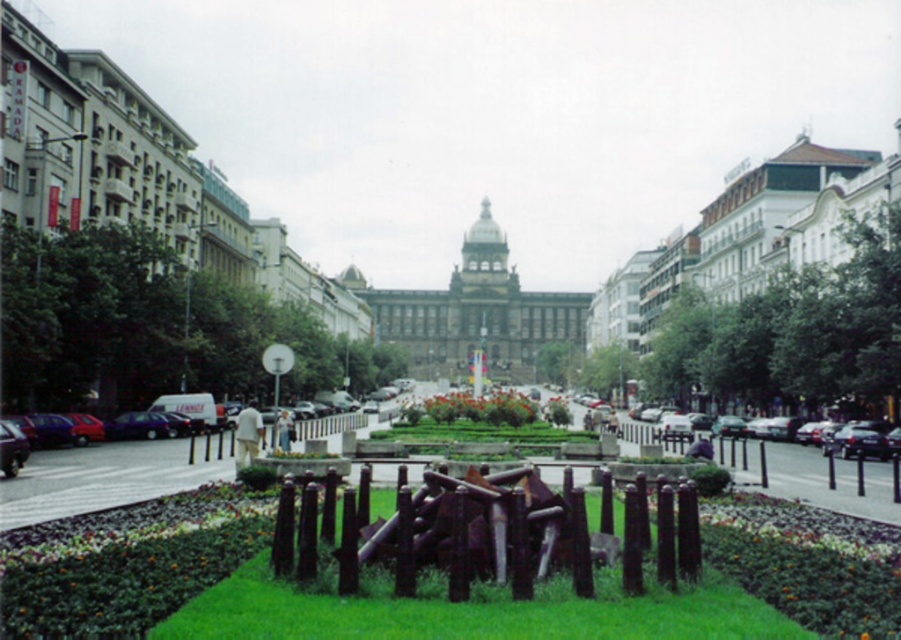
Question: Considering the relative positions of green grass at center and black metal fence at lower right in the image provided, where is green grass at center located with respect to black metal fence at lower right?

Choices:
 (A) left
 (B) right

Answer: (A)

Question: Based on their relative distances, which object is nearer to the green grass at center?

Choices:
 (A) black metal fence at lower right
 (B) dark brown wooden fence at center

Answer: (B)

Question: Is green grass at center closer to the viewer compared to black metal fence at lower right?

Choices:
 (A) yes
 (B) no

Answer: (A)

Question: Which point is farther to the camera?

Choices:
 (A) (450, 552)
 (B) (549, 632)
 (C) (854, 477)

Answer: (C)

Question: Which object is positioned farthest from the black metal fence at lower right?

Choices:
 (A) dark brown wooden fence at center
 (B) green grass at center

Answer: (B)

Question: Is green grass at center above black metal fence at lower right?

Choices:
 (A) no
 (B) yes

Answer: (A)